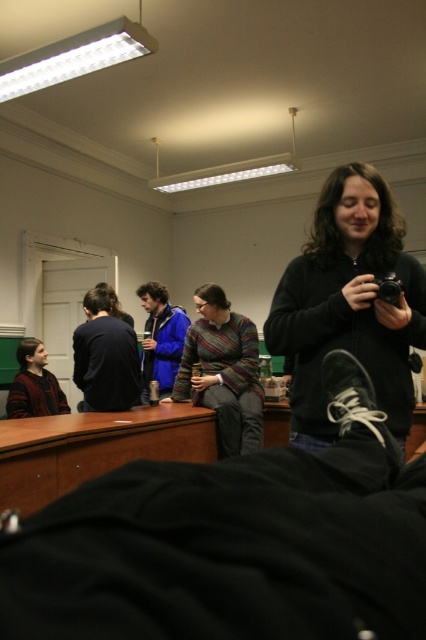
You are organizing a clothing donation drive and need to categorize the black matte sweater at center and the knitted sweater at lower left based on their sizes. Which sweater should be placed in the large size bin?

The black matte sweater at center should be placed in the large size bin because it is bigger than the knitted sweater at lower left.